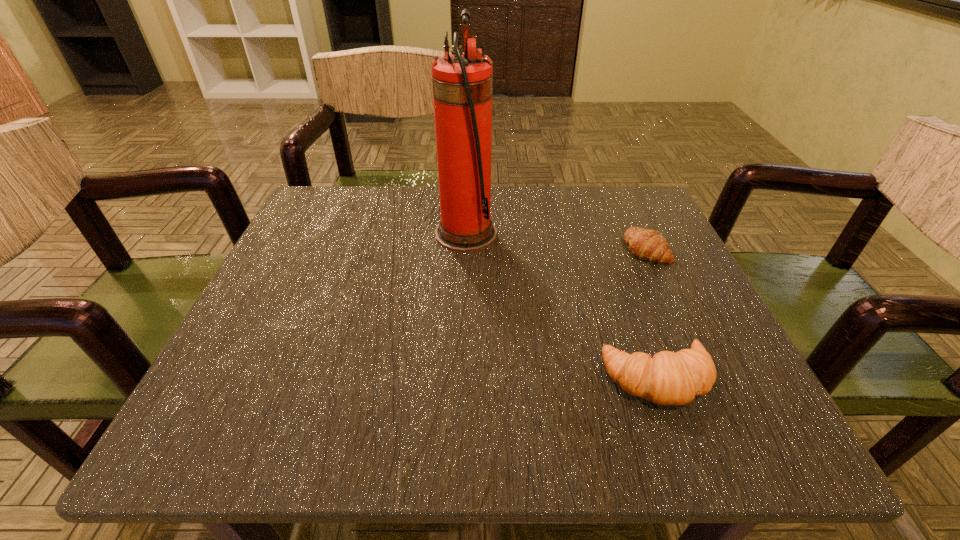
In the image, there is a desktop. Identify the location of vacant space at the far right corner. (646, 191).

Locate an element on the screen. The height and width of the screenshot is (540, 960). vacant region at the near right corner is located at coordinates (674, 439).

The height and width of the screenshot is (540, 960). I want to click on unoccupied area between the second shortest object and the leftmost object, so click(x=562, y=306).

Locate an element on the screen. Image resolution: width=960 pixels, height=540 pixels. vacant region between the farther crescent roll and the nearer crescent roll is located at coordinates (652, 314).

This screenshot has height=540, width=960. What are the coordinates of `free space that is in between the tallest object and the second shortest object` in the screenshot? It's located at (562, 306).

The width and height of the screenshot is (960, 540). What are the coordinates of `vacant space that's between the second shortest object and the shorter crescent roll` in the screenshot? It's located at click(x=652, y=314).

What are the coordinates of `free space that is in between the taller crescent roll and the shortest object` in the screenshot? It's located at (652, 314).

This screenshot has height=540, width=960. Find the location of `empty location between the shorter crescent roll and the leftmost object`. empty location between the shorter crescent roll and the leftmost object is located at coordinates (556, 241).

Locate an element on the screen. free spot between the shortest object and the second tallest object is located at coordinates (652, 314).

This screenshot has width=960, height=540. I want to click on free spot between the nearer crescent roll and the shorter crescent roll, so click(x=652, y=314).